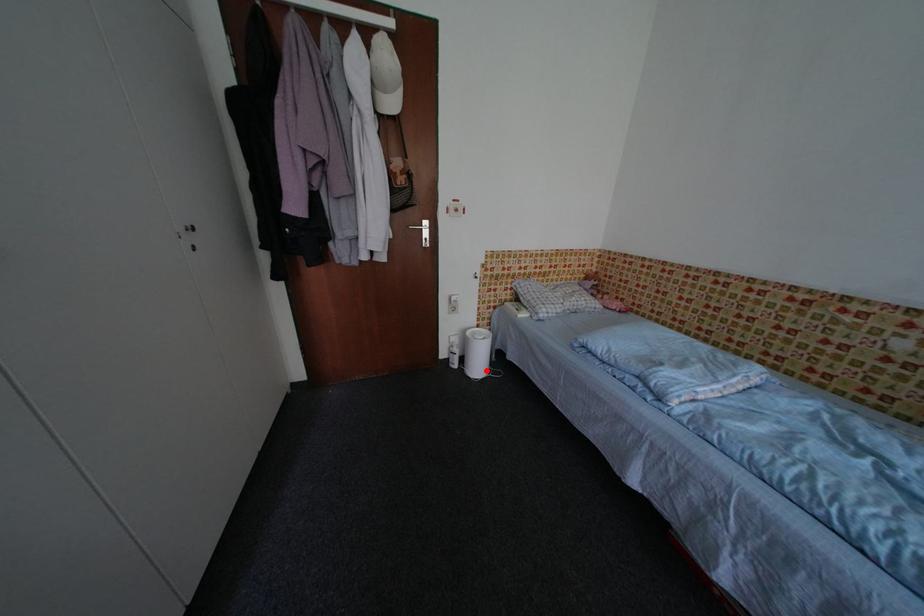
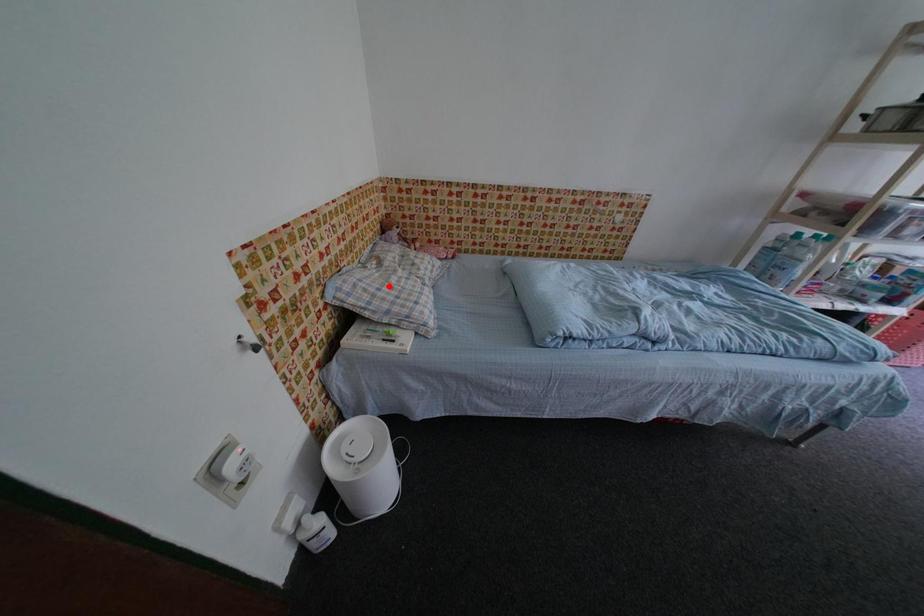
I am providing you with two images of the same scene from different viewpoints. A red point is marked on the first image and another point is marked on the second image. Does the point marked in image1 correspond to the same location as the one in image2?

No